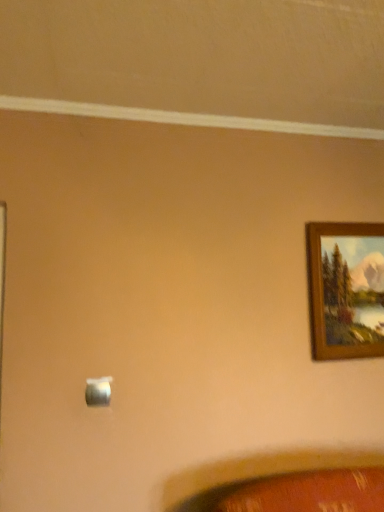
Question: Considering their positions, is wooden picture frame at upper right located in front of or behind satin silver switch at lower center?

Choices:
 (A) behind
 (B) front

Answer: (A)

Question: Looking at the image, does wooden picture frame at upper right seem bigger or smaller compared to satin silver switch at lower center?

Choices:
 (A) small
 (B) big

Answer: (B)

Question: In terms of width, does wooden picture frame at upper right look wider or thinner when compared to satin silver switch at lower center?

Choices:
 (A) thin
 (B) wide

Answer: (B)

Question: Is satin silver switch at lower center taller or shorter than wooden picture frame at upper right?

Choices:
 (A) tall
 (B) short

Answer: (B)

Question: Is point (97, 397) positioned closer to the camera than point (352, 276)?

Choices:
 (A) farther
 (B) closer

Answer: (B)

Question: From the image's perspective, is satin silver switch at lower center positioned above or below wooden picture frame at upper right?

Choices:
 (A) above
 (B) below

Answer: (B)

Question: In the image, is satin silver switch at lower center on the left side or the right side of wooden picture frame at upper right?

Choices:
 (A) left
 (B) right

Answer: (A)